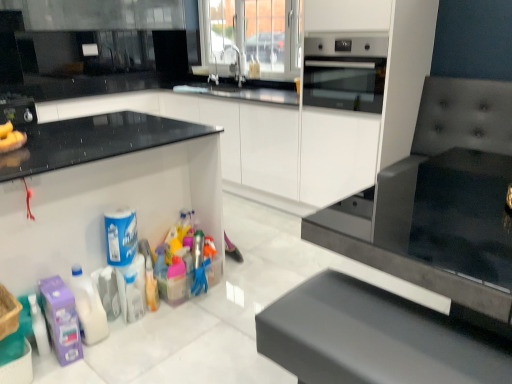
Question: Would you consider black leather cushion at lower center to be distant from brushed metal toaster at left?

Choices:
 (A) yes
 (B) no

Answer: (A)

Question: From the image's perspective, is black leather cushion at lower center under brushed metal toaster at left?

Choices:
 (A) yes
 (B) no

Answer: (A)

Question: Is black leather cushion at lower center at the right side of brushed metal toaster at left?

Choices:
 (A) no
 (B) yes

Answer: (B)

Question: Does black leather cushion at lower center have a smaller size compared to brushed metal toaster at left?

Choices:
 (A) yes
 (B) no

Answer: (B)

Question: Is black leather cushion at lower center turned away from brushed metal toaster at left?

Choices:
 (A) no
 (B) yes

Answer: (A)

Question: Can you confirm if black leather cushion at lower center is thinner than brushed metal toaster at left?

Choices:
 (A) yes
 (B) no

Answer: (A)

Question: Is translucent plastic container at center, the 4th cleaning product positioned from the left, to the left of brushed metal toaster at left from the viewer's perspective?

Choices:
 (A) yes
 (B) no

Answer: (B)

Question: Can you confirm if translucent plastic container at center, the first cleaning product viewed from the right, is wider than brushed metal toaster at left?

Choices:
 (A) no
 (B) yes

Answer: (A)

Question: From a real-world perspective, is translucent plastic container at center, the first cleaning product viewed from the right, beneath brushed metal toaster at left?

Choices:
 (A) yes
 (B) no

Answer: (A)

Question: Is translucent plastic container at center, the 4th cleaning product positioned from the left, to the right of brushed metal toaster at left from the viewer's perspective?

Choices:
 (A) yes
 (B) no

Answer: (A)

Question: Considering the relative positions of translucent plastic container at center, the first cleaning product viewed from the right, and brushed metal toaster at left in the image provided, is translucent plastic container at center, the first cleaning product viewed from the right, in front of brushed metal toaster at left?

Choices:
 (A) no
 (B) yes

Answer: (B)

Question: Is brushed metal toaster at left at the back of translucent plastic container at center, the first cleaning product viewed from the right?

Choices:
 (A) no
 (B) yes

Answer: (B)

Question: Would you say purple matte cleaning product at lower left, which is the 4th cleaning product from right to left, is part of white glossy cabinet at center, which is the 2th cabinetry in front-to-back order,'s contents?

Choices:
 (A) yes
 (B) no

Answer: (B)